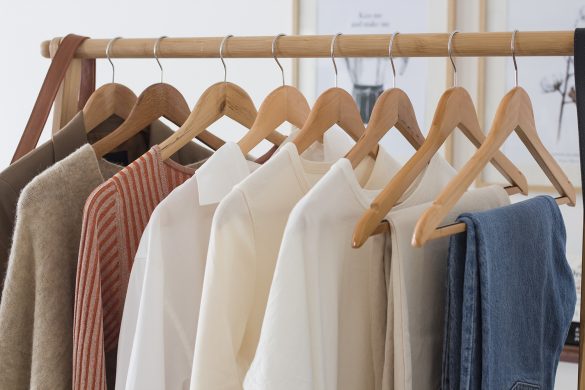
Image resolution: width=585 pixels, height=390 pixels. I want to click on clothes hangers, so click(113, 102), click(156, 105), click(276, 103), click(225, 105), click(335, 113), click(393, 114), click(453, 113), click(514, 113).